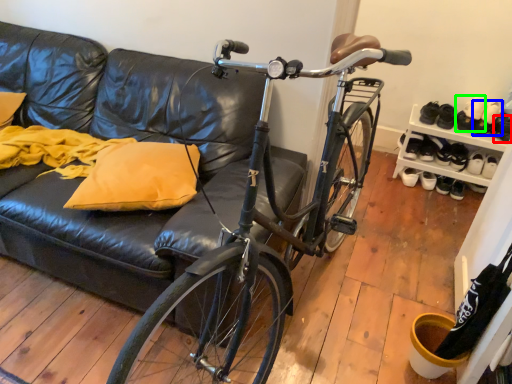
Question: Based on their relative distances, which object is nearer to shoe (highlighted by a red box)? Choose from footwear (highlighted by a blue box) and footwear (highlighted by a green box).

Choices:
 (A) footwear
 (B) footwear

Answer: (A)